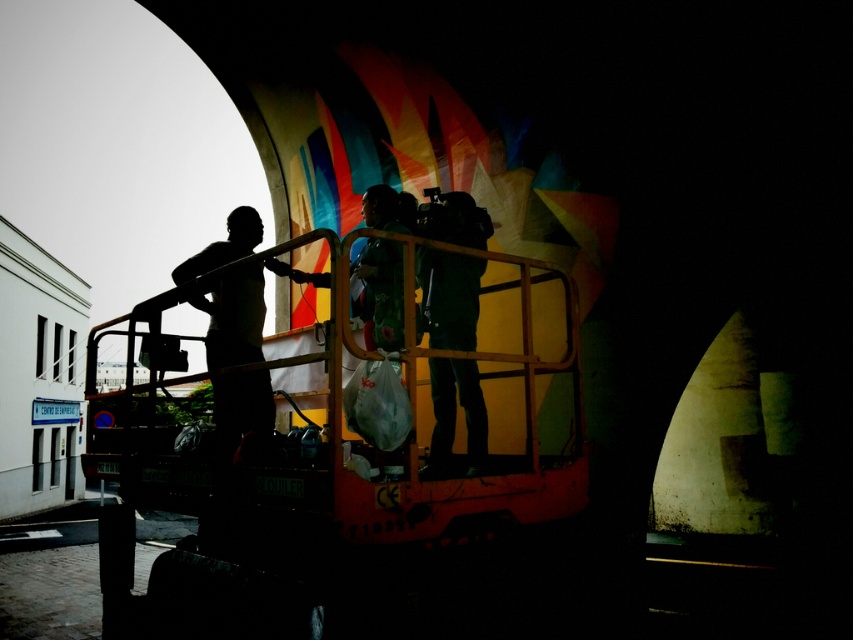
Question: Can you confirm if metallic yellow truck at center is bigger than dark green fabric at center?

Choices:
 (A) no
 (B) yes

Answer: (B)

Question: Can you confirm if metallic yellow truck at center is positioned above silhouette man at left?

Choices:
 (A) yes
 (B) no

Answer: (B)

Question: Among these points, which one is farthest from the camera?

Choices:
 (A) coord(236,396)
 (B) coord(343,534)
 (C) coord(440,436)

Answer: (C)

Question: Which of these objects is positioned closest to the dark green fabric at center?

Choices:
 (A) silhouette man at left
 (B) metallic yellow truck at center

Answer: (B)

Question: Estimate the real-world distances between objects in this image. Which object is farther from the silhouette man at left?

Choices:
 (A) dark green fabric at center
 (B) metallic yellow truck at center

Answer: (A)

Question: Can you confirm if metallic yellow truck at center is thinner than silhouette man at left?

Choices:
 (A) no
 (B) yes

Answer: (A)